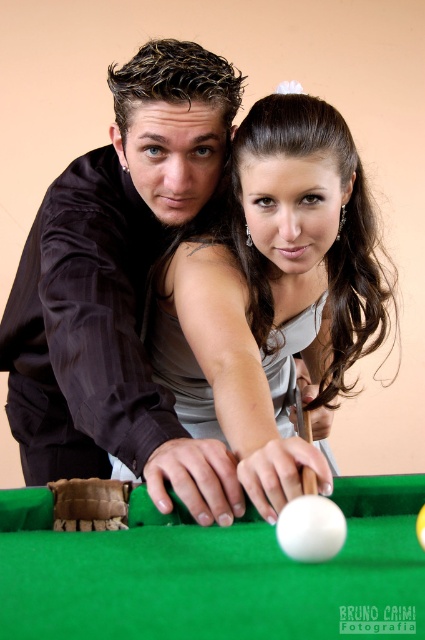
Does point (356, 179) lie in front of point (295, 408)?

Yes.

What do you see at coordinates (274, 288) in the screenshot? I see `satin silver dress at center` at bounding box center [274, 288].

This screenshot has height=640, width=425. In order to click on satin silver dress at center in this screenshot , I will do `click(274, 288)`.

Is point (215, 118) positioned before point (343, 557)?

No, (215, 118) is further to viewer.

Consider the image. Who is more forward, [45,358] or [209,529]?

Point [209,529] is more forward.

This screenshot has width=425, height=640. Identify the location of satin black shirt at center. (119, 288).

Can you confirm if satin black shirt at center is positioned below white matte cue at center?

Actually, satin black shirt at center is above white matte cue at center.

Is satin black shirt at center smaller than white matte cue at center?

Incorrect, satin black shirt at center is not smaller in size than white matte cue at center.

Is point (90, 358) positioned after point (308, 428)?

No, (90, 358) is closer to viewer.

The image size is (425, 640). Identify the location of satin black shirt at center. (119, 288).